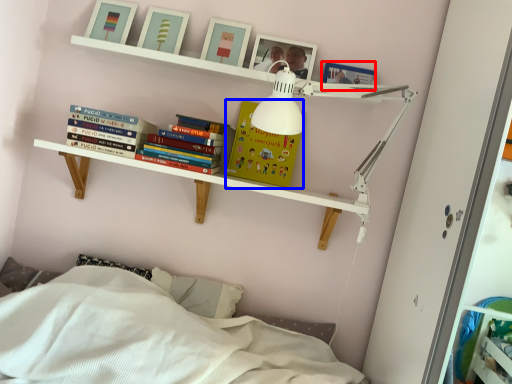
Question: Among these objects, which one is nearest to the camera, picture frame (highlighted by a red box) or paperback book (highlighted by a blue box)?

Choices:
 (A) picture frame
 (B) paperback book

Answer: (A)